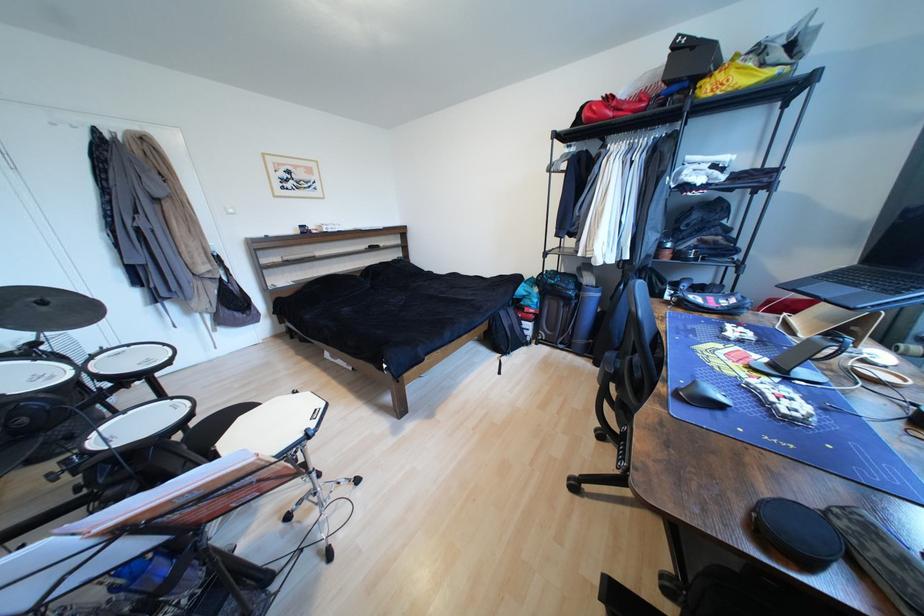
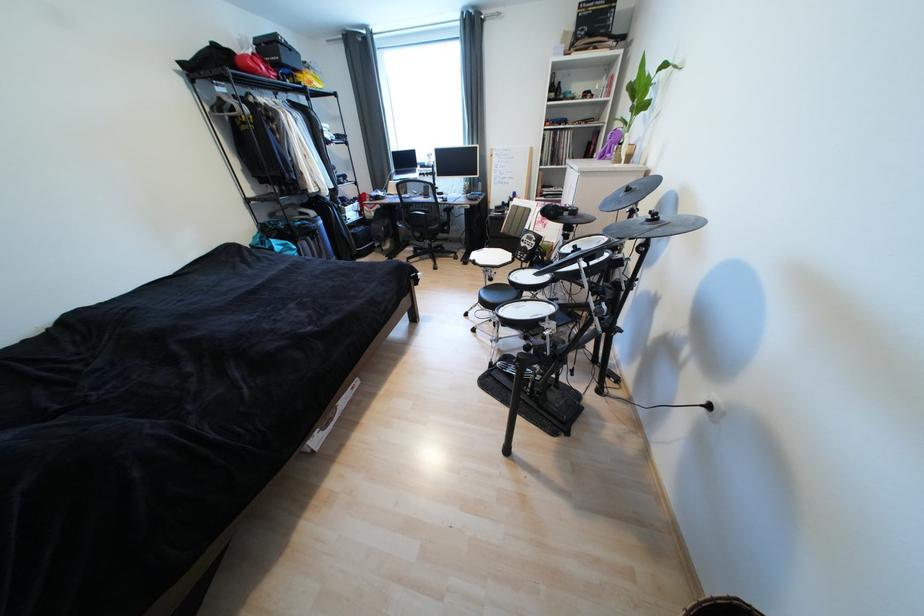
Find the pixel in the second image that matches (x=596, y=121) in the first image.

(261, 73)